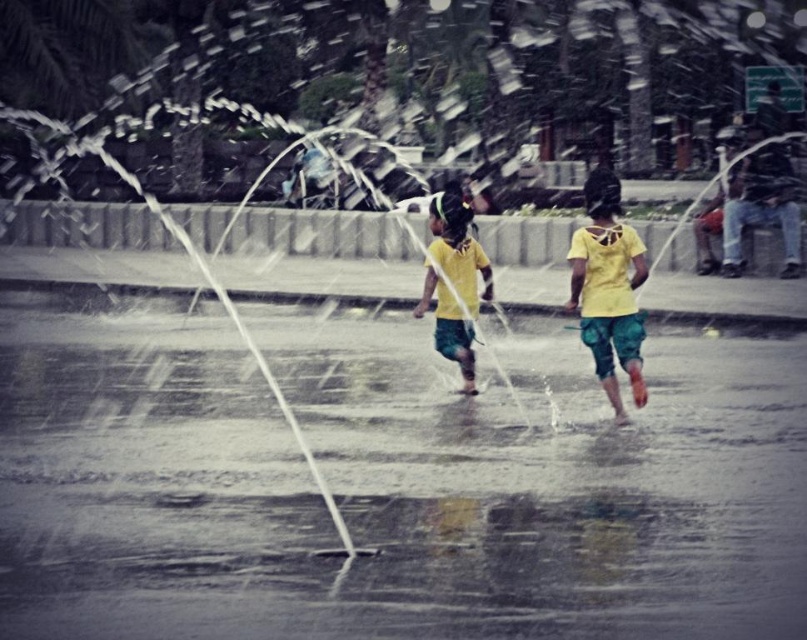
Consider the image. You are a photographer trying to capture the children playing in the fountain. You need to frame the shot so that the clear water at center is wider than the yellow fabric shorts at center. Can you adjust your camera angle to achieve this?

Yes, since the clear water at center is already wider than the yellow fabric shorts at center, adjusting the camera angle can emphasize this difference, ensuring the water appears wider in the frame.

You are a photographer trying to capture the children in the water fountain. Based on the scene, can you determine if the yellow matte shirt at center is currently getting wet from the clear water at center?

The clear water at center is below the yellow matte shirt at center, so the yellow matte shirt at center is likely getting wet from the water below it.

From the picture: You are a photographer trying to capture a shot of the clear water at center and the yellow matte shirt at center. Which object should you focus on if you want to emphasize the larger subject in your photo?

The clear water at center is larger in size than the yellow matte shirt at center, so you should focus on the clear water at center to emphasize the larger subject in your photo.